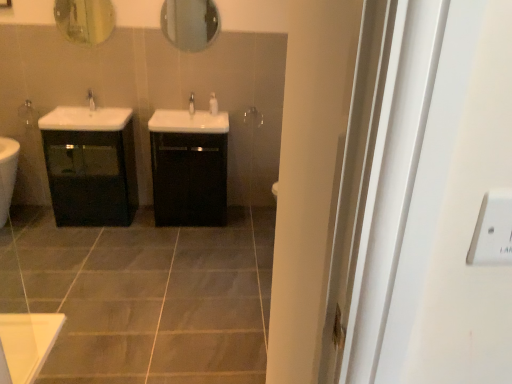
Describe the element at coordinates (213, 104) in the screenshot. I see `white glossy soap dispenser at center` at that location.

This screenshot has width=512, height=384. In order to click on black glossy cabinet at center, arranged as the 1th bathroom cabinet when viewed from the right in this screenshot , I will do `click(189, 167)`.

At what (x,y) coordinates should I click in order to perform the action: click on glossy glass mirror at upper center, marked as the first mirror in a right-to-left arrangement. Please return your answer as a coordinate pair (x, y). Looking at the image, I should click on (190, 23).

Where is `white glossy soap dispenser at center`? This screenshot has width=512, height=384. white glossy soap dispenser at center is located at coordinates (213, 104).

Does point (47, 360) lie behind point (123, 109)?

No, it is not.

Can you confirm if gray matte tile at center is bigger than matte black cabinet at left, the second bathroom cabinet in the right-to-left sequence?

Yes.

Is gray matte tile at center positioned with its back to matte black cabinet at left, the first bathroom cabinet positioned from the left?

No, matte black cabinet at left, the first bathroom cabinet positioned from the left, is not at the back of gray matte tile at center.

Can you confirm if gray matte tile at center is positioned to the right of matte black cabinet at left, the first bathroom cabinet positioned from the left?

Yes.

From a real-world perspective, between white glossy soap dispenser at center and gray matte tile at center, who is vertically lower?

In real-world perspective, gray matte tile at center is lower.

From the image's perspective, between white glossy soap dispenser at center and gray matte tile at center, which one is located above?

white glossy soap dispenser at center, from the image's perspective.

Can you tell me how much white glossy soap dispenser at center and gray matte tile at center differ in facing direction?

0.811 degrees separate the facing orientations of white glossy soap dispenser at center and gray matte tile at center.

Which is in front, point (214, 107) or point (81, 354)?

The point (81, 354) is in front.

Is glossy glass mirror at upper center, marked as the first mirror in a right-to-left arrangement, turned away from white glossy tap at center, which appears as the 1th tap when viewed from the right?

No.

Can you see glossy glass mirror at upper center, marked as the first mirror in a right-to-left arrangement, touching white glossy tap at center, which appears as the 1th tap when viewed from the right?

No, glossy glass mirror at upper center, marked as the first mirror in a right-to-left arrangement, is not next to white glossy tap at center, which appears as the 1th tap when viewed from the right.

Considering the relative positions of glossy glass mirror at upper center, which is the second mirror from left to right, and white glossy tap at center, the 2th tap positioned from the left, in the image provided, is glossy glass mirror at upper center, which is the second mirror from left to right, to the left of white glossy tap at center, the 2th tap positioned from the left, from the viewer's perspective?

In fact, glossy glass mirror at upper center, which is the second mirror from left to right, is to the right of white glossy tap at center, the 2th tap positioned from the left.

Could you measure the distance between glossy glass mirror at upper center, which is the second mirror from left to right, and white glossy tap at center, which appears as the 1th tap when viewed from the right?

glossy glass mirror at upper center, which is the second mirror from left to right, is 21.45 inches from white glossy tap at center, which appears as the 1th tap when viewed from the right.

Considering their positions, is gray matte tile at center located in front of or behind matte glass mirror at upper left, arranged as the 1th mirror when viewed from the left?

Visually, gray matte tile at center is located in front of matte glass mirror at upper left, arranged as the 1th mirror when viewed from the left.

In the scene shown: Which object is wider, gray matte tile at center or matte glass mirror at upper left, the 2th mirror from the right?

With larger width is gray matte tile at center.

In the image, there is a matte glass mirror at upper left, the 2th mirror from the right. Where is `ceramic tile below it (from the image's perspective)`? The image size is (512, 384). ceramic tile below it (from the image's perspective) is located at coordinates (151, 297).

From the image's perspective, between gray matte tile at center and matte glass mirror at upper left, the 2th mirror from the right, who is located below?

gray matte tile at center is shown below in the image.

From a real-world perspective, is matte glass mirror at upper left, the 2th mirror from the right, under matte silver faucet at center, the 1th tap in the left-to-right sequence?

Incorrect, from a real-world perspective, matte glass mirror at upper left, the 2th mirror from the right, is higher than matte silver faucet at center, the 1th tap in the left-to-right sequence.

Consider the image. Is matte glass mirror at upper left, the 2th mirror from the right, looking in the opposite direction of matte silver faucet at center, the 1th tap in the left-to-right sequence?

That's not correct — matte glass mirror at upper left, the 2th mirror from the right, is not looking away from matte silver faucet at center, the 1th tap in the left-to-right sequence.

Is the position of matte glass mirror at upper left, arranged as the 1th mirror when viewed from the left, more distant than that of matte silver faucet at center, placed as the second tap when sorted from right to left?

No, matte glass mirror at upper left, arranged as the 1th mirror when viewed from the left, is closer to the camera.

Which is more to the left, white glossy tap at center, the 2th tap positioned from the left, or white glossy soap dispenser at center?

white glossy tap at center, the 2th tap positioned from the left.

Find the location of a particular element. The height and width of the screenshot is (384, 512). soap dispenser on the right of white glossy tap at center, the 2th tap positioned from the left is located at coordinates (213, 104).

Is there a large distance between white glossy tap at center, the 2th tap positioned from the left, and white glossy soap dispenser at center?

white glossy tap at center, the 2th tap positioned from the left, is near white glossy soap dispenser at center, not far away.

Which object is further away from the camera, white glossy tap at center, the 2th tap positioned from the left, or white glossy soap dispenser at center?

white glossy soap dispenser at center is behind.

Which point is more distant from viewer, (x=192, y=97) or (x=89, y=225)?

The point (x=192, y=97) is farther from the camera.

Is there a large distance between white glossy tap at center, which appears as the 1th tap when viewed from the right, and matte black cabinet at left, the second bathroom cabinet in the right-to-left sequence?

No, white glossy tap at center, which appears as the 1th tap when viewed from the right, is in close proximity to matte black cabinet at left, the second bathroom cabinet in the right-to-left sequence.

Is white glossy tap at center, which appears as the 1th tap when viewed from the right, at the left side of matte black cabinet at left, the second bathroom cabinet in the right-to-left sequence?

In fact, white glossy tap at center, which appears as the 1th tap when viewed from the right, is to the right of matte black cabinet at left, the second bathroom cabinet in the right-to-left sequence.

Locate an element on the screen. The width and height of the screenshot is (512, 384). bathroom cabinet on the left side of gray matte tile at center is located at coordinates (90, 165).

I want to click on ceramic tile located below the white glossy soap dispenser at center (from the image's perspective), so click(x=151, y=297).

When comparing their distances from white glossy soap dispenser at center, does matte glass mirror at upper left, the 2th mirror from the right, or gray matte tile at center seem further?

Based on the image, gray matte tile at center appears to be further to white glossy soap dispenser at center.

Considering their positions, is black glossy cabinet at center, arranged as the 1th bathroom cabinet when viewed from the right, positioned closer to matte silver faucet at center, the 1th tap in the left-to-right sequence, than glossy glass mirror at upper center, marked as the first mirror in a right-to-left arrangement?

Based on the image, glossy glass mirror at upper center, marked as the first mirror in a right-to-left arrangement, appears to be nearer to matte silver faucet at center, the 1th tap in the left-to-right sequence.

When comparing their distances from glossy glass mirror at upper center, which is the second mirror from left to right, does gray matte tile at center or matte glass mirror at upper left, the 2th mirror from the right, seem closer?

The object closer to glossy glass mirror at upper center, which is the second mirror from left to right, is matte glass mirror at upper left, the 2th mirror from the right.

Based on their spatial positions, is matte silver faucet at center, placed as the second tap when sorted from right to left, or gray matte tile at center closer to white glossy tap at center, which appears as the 1th tap when viewed from the right?

matte silver faucet at center, placed as the second tap when sorted from right to left.

When comparing their distances from matte black cabinet at left, the second bathroom cabinet in the right-to-left sequence, does white glossy tap at center, which appears as the 1th tap when viewed from the right, or matte silver faucet at center, the 1th tap in the left-to-right sequence, seem closer?

Among the two, matte silver faucet at center, the 1th tap in the left-to-right sequence, is located nearer to matte black cabinet at left, the second bathroom cabinet in the right-to-left sequence.

Looking at the image, which one is located further to matte glass mirror at upper left, the 2th mirror from the right, black glossy cabinet at center, arranged as the 1th bathroom cabinet when viewed from the right, or matte black cabinet at left, the first bathroom cabinet positioned from the left?

Based on the image, black glossy cabinet at center, arranged as the 1th bathroom cabinet when viewed from the right, appears to be further to matte glass mirror at upper left, the 2th mirror from the right.

Based on their spatial positions, is matte silver faucet at center, the 1th tap in the left-to-right sequence, or matte black cabinet at left, the second bathroom cabinet in the right-to-left sequence, closer to matte glass mirror at upper left, the 2th mirror from the right?

Among the two, matte silver faucet at center, the 1th tap in the left-to-right sequence, is located nearer to matte glass mirror at upper left, the 2th mirror from the right.

Estimate the real-world distances between objects in this image. Which object is closer to white glossy tap at center, which appears as the 1th tap when viewed from the right, glossy glass mirror at upper center, which is the second mirror from left to right, or matte glass mirror at upper left, the 2th mirror from the right?

Among the two, glossy glass mirror at upper center, which is the second mirror from left to right, is located nearer to white glossy tap at center, which appears as the 1th tap when viewed from the right.

Identify the location of soap dispenser between matte glass mirror at upper left, arranged as the 1th mirror when viewed from the left, and gray matte tile at center from top to bottom. (213, 104).

Image resolution: width=512 pixels, height=384 pixels. In order to click on bathroom cabinet between matte silver faucet at center, the 1th tap in the left-to-right sequence, and white glossy soap dispenser at center in this screenshot , I will do `click(189, 167)`.

This screenshot has height=384, width=512. Identify the location of mirror between matte glass mirror at upper left, arranged as the 1th mirror when viewed from the left, and matte black cabinet at left, the second bathroom cabinet in the right-to-left sequence, in the vertical direction. (190, 23).

This screenshot has height=384, width=512. Identify the location of soap dispenser between glossy glass mirror at upper center, marked as the first mirror in a right-to-left arrangement, and gray matte tile at center from top to bottom. (213, 104).